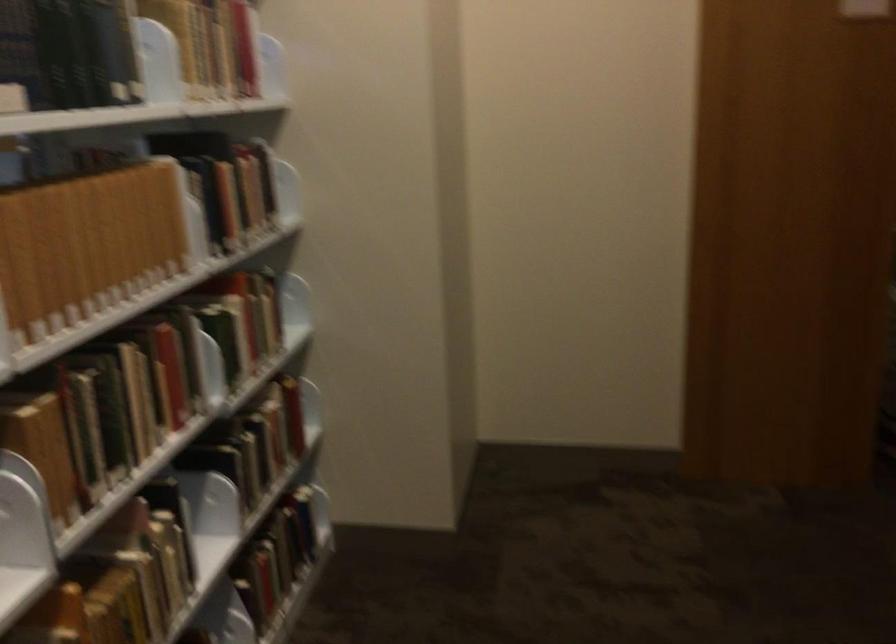
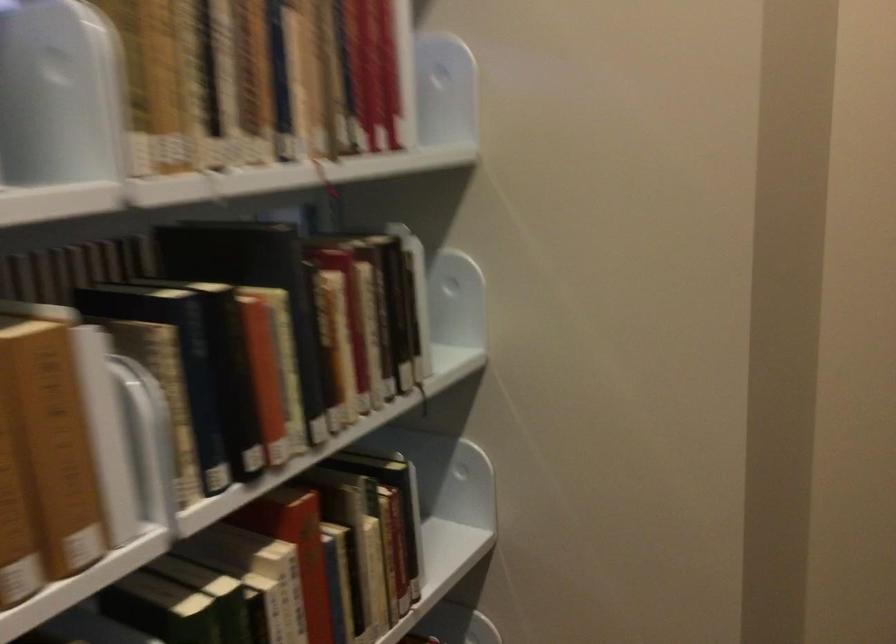
In the second image, find the point that corresponds to pixel 196 158 in the first image.

(188, 288)